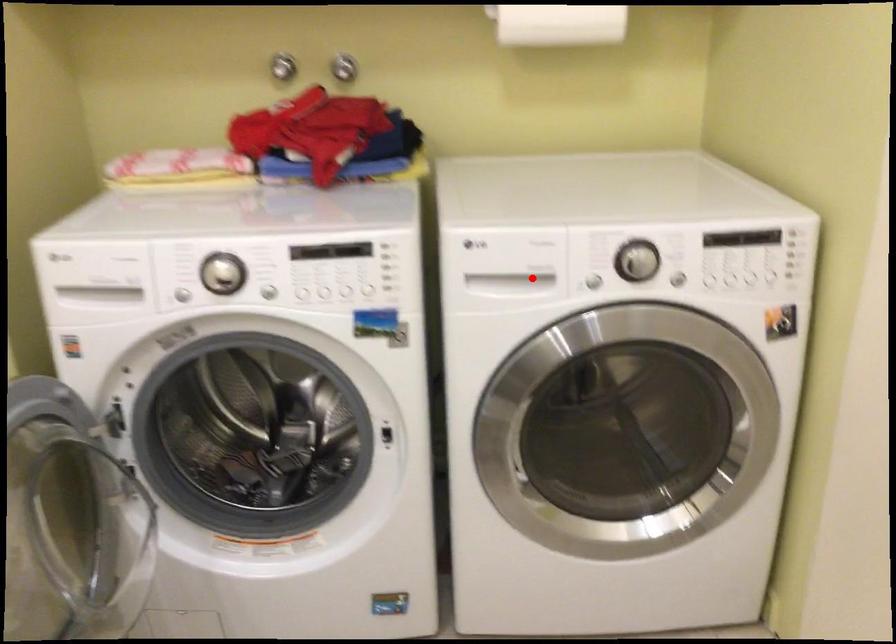
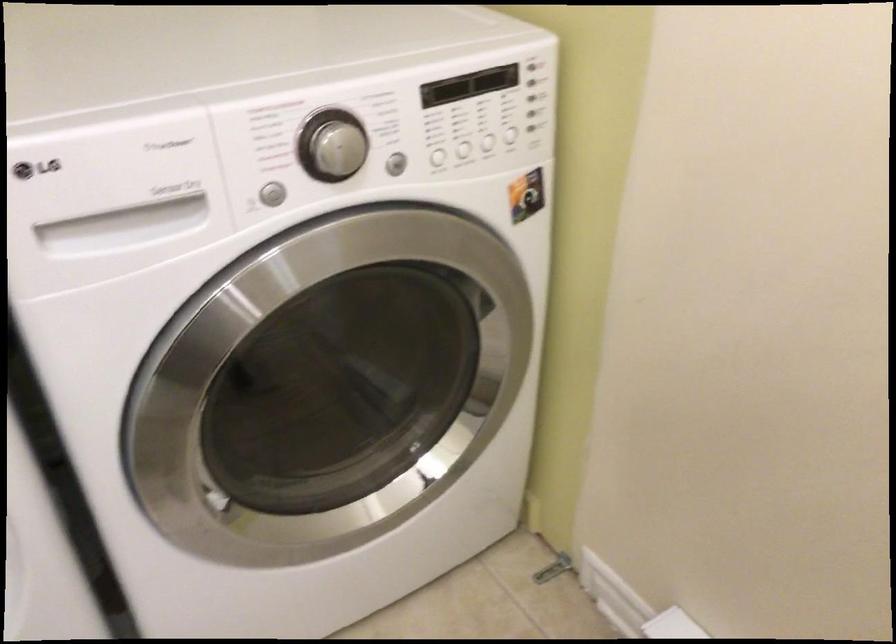
Question: I am providing you with two images of the same scene from different viewpoints. In image1, a red point is highlighted. Considering the same 3D point in image2, which of the following is correct?

Choices:
 (A) It is closer
 (B) It is farther

Answer: (A)